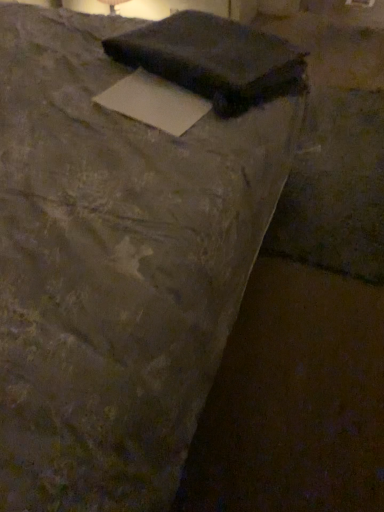
Question: Is white paper at center, the second writing from the top, in front of or behind matte black laptop at upper center, which is the second writing from bottom to top, in the image?

Choices:
 (A) behind
 (B) front

Answer: (B)

Question: Would you say white paper at center, marked as the 1th writing in a bottom-to-top arrangement, is inside or outside matte black laptop at upper center, which is the second writing from bottom to top?

Choices:
 (A) inside
 (B) outside

Answer: (B)

Question: Visually, is white paper at center, the second writing from the top, positioned to the left or to the right of matte black laptop at upper center, which is the second writing from bottom to top?

Choices:
 (A) right
 (B) left

Answer: (B)

Question: Considering the positions of matte black laptop at upper center, which ranks as the 1th writing in top-to-bottom order, and white paper at center, marked as the 1th writing in a bottom-to-top arrangement, in the image, is matte black laptop at upper center, which ranks as the 1th writing in top-to-bottom order, wider or thinner than white paper at center, marked as the 1th writing in a bottom-to-top arrangement,?

Choices:
 (A) thin
 (B) wide

Answer: (B)

Question: Visually, is matte black laptop at upper center, which ranks as the 1th writing in top-to-bottom order, positioned to the left or to the right of white paper at center, marked as the 1th writing in a bottom-to-top arrangement?

Choices:
 (A) left
 (B) right

Answer: (B)

Question: From a real-world perspective, is matte black laptop at upper center, which is the second writing from bottom to top, above or below white paper at center, the second writing from the top?

Choices:
 (A) above
 (B) below

Answer: (A)

Question: Is matte black laptop at upper center, which is the second writing from bottom to top, situated inside white paper at center, the second writing from the top, or outside?

Choices:
 (A) outside
 (B) inside

Answer: (A)